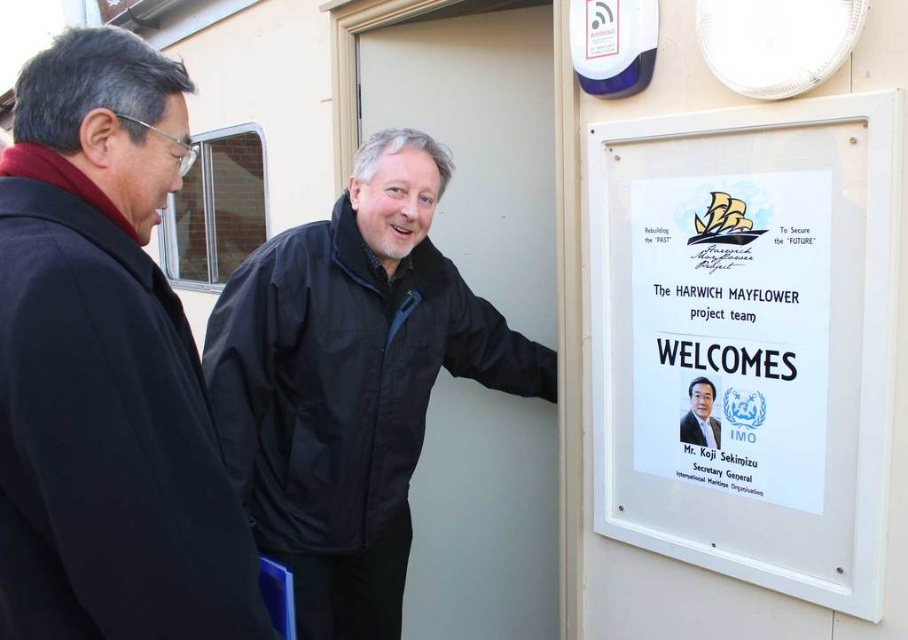
The image size is (908, 640). Describe the element at coordinates (351, 381) in the screenshot. I see `black matte jacket at center` at that location.

Is black matte jacket at center shorter than white paper at center?

No.

Looking at this image, who is more forward, (221, 388) or (673, 236)?

Point (673, 236) is in front.

I want to click on black matte jacket at center, so click(x=351, y=381).

Which is more to the right, white plastic sign at center or black matte jacket at center?

Positioned to the right is white plastic sign at center.

Is white plastic sign at center shorter than black matte jacket at center?

Yes, white plastic sign at center is shorter than black matte jacket at center.

Who is more forward, (652, 161) or (342, 388)?

Point (652, 161)

Where is `white plastic sign at center`? This screenshot has width=908, height=640. white plastic sign at center is located at coordinates (748, 339).

Is black matte coat at left closer to the viewer compared to black matte jacket at center?

Yes, it is.

Can you confirm if black matte coat at left is shorter than black matte jacket at center?

Indeed, black matte coat at left has a lesser height compared to black matte jacket at center.

Where is `black matte coat at left`? This screenshot has width=908, height=640. black matte coat at left is located at coordinates (106, 369).